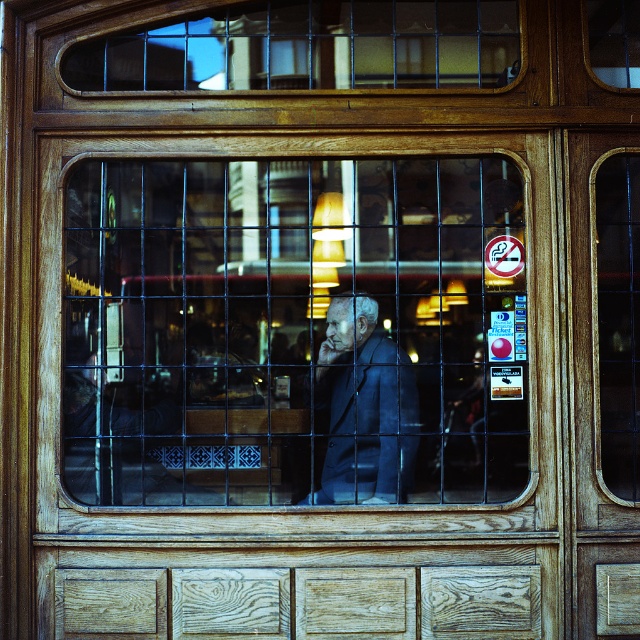
Question: Which point appears farthest from the camera in this image?

Choices:
 (A) (390, 456)
 (B) (422, 401)

Answer: (B)

Question: Does matte glass window at center appear under dark blue suit at center?

Choices:
 (A) no
 (B) yes

Answer: (A)

Question: Can you confirm if matte glass window at center is positioned to the left of dark blue suit at center?

Choices:
 (A) no
 (B) yes

Answer: (B)

Question: Is matte glass window at center to the left of dark blue suit at center from the viewer's perspective?

Choices:
 (A) no
 (B) yes

Answer: (B)